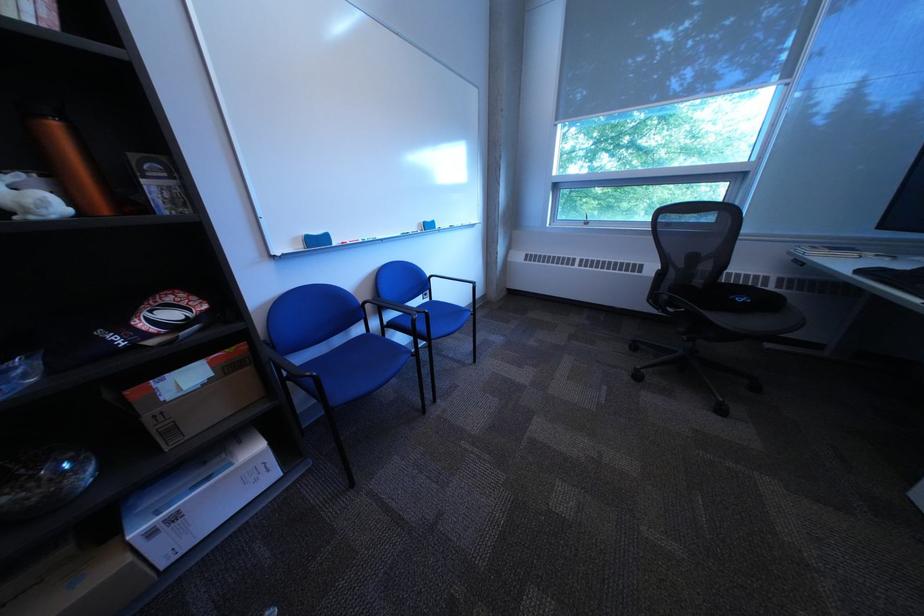
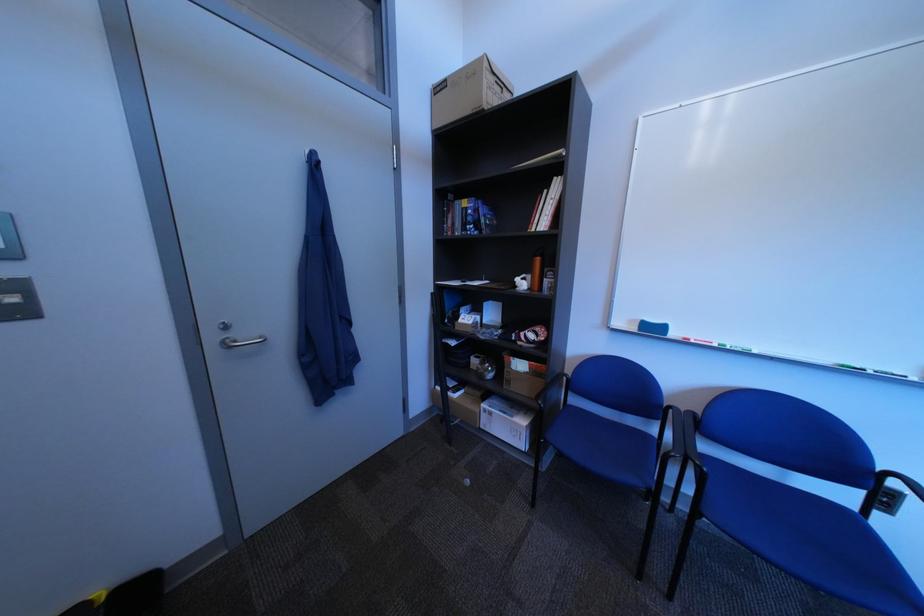
The point at (178, 569) is marked in the first image. Where is the corresponding point in the second image?

(496, 429)